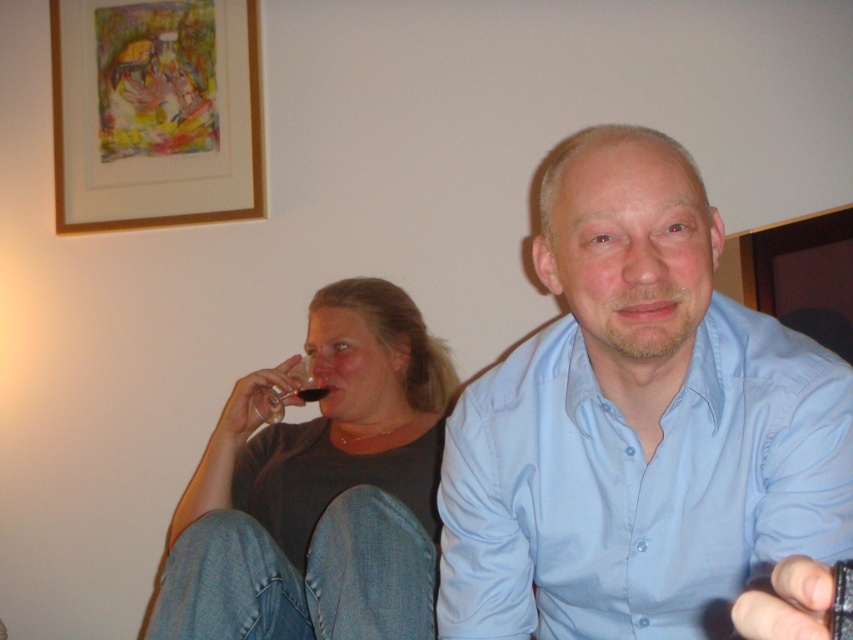
Measure the distance between light blue button-down shirt at center and camera.

30.54 inches

Between point (715, 429) and point (259, 400), which one is positioned in front?

Point (715, 429) is in front.

Who is more forward, (524, 442) or (289, 394)?

Point (524, 442) is in front.

The height and width of the screenshot is (640, 853). I want to click on light blue button-down shirt at center, so click(x=637, y=424).

Which is above, light blue button-down shirt at center or translucent glass at upper center?

translucent glass at upper center is above.

Can you confirm if light blue button-down shirt at center is positioned to the left of translucent glass at upper center?

Incorrect, light blue button-down shirt at center is not on the left side of translucent glass at upper center.

Does point (728, 577) lie behind point (312, 392)?

No, (728, 577) is in front of (312, 392).

Find the location of a particular element. The image size is (853, 640). light blue button-down shirt at center is located at coordinates (637, 424).

Is wooden picture frame at upper left wider than translucent glass at upper center?

Yes.

Who is more distant from viewer, (224, 83) or (316, 394)?

The point (224, 83) is more distant.

Locate an element on the screen. wooden picture frame at upper left is located at coordinates (155, 113).